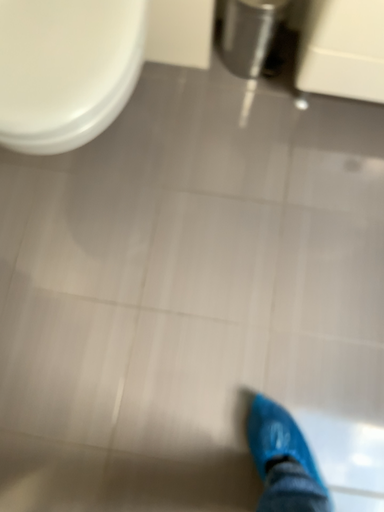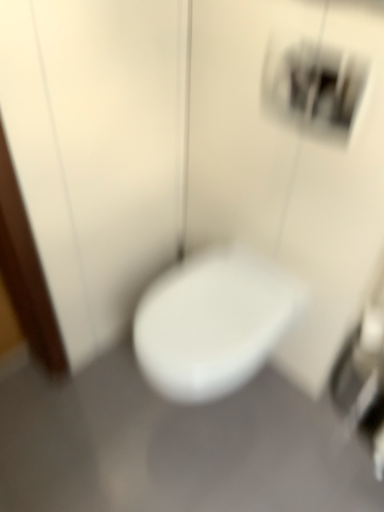
Question: How did the camera likely rotate when shooting the video?

Choices:
 (A) rotated right
 (B) rotated left

Answer: (B)